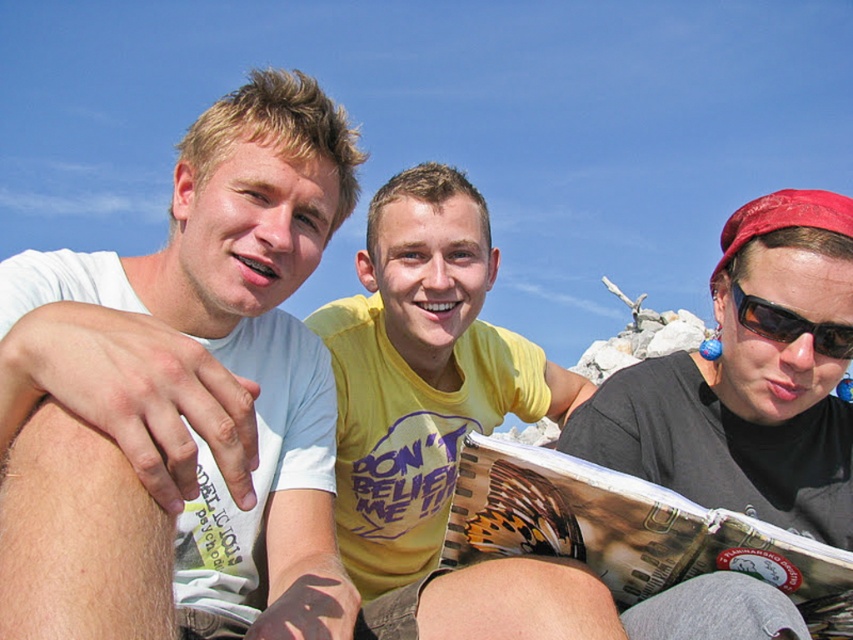
Question: Is white matte t-shirt at left thinner than black plastic sunglasses at right?

Choices:
 (A) no
 (B) yes

Answer: (A)

Question: Which object is farther from the camera taking this photo?

Choices:
 (A) printed paper magazine at center
 (B) yellow t-shirt at center
 (C) matte black sunglasses at upper right
 (D) black plastic sunglasses at right

Answer: (D)

Question: Among these points, which one is nearest to the camera?

Choices:
 (A) (451, 269)
 (B) (47, 292)

Answer: (B)

Question: Is printed paper magazine at center positioned before black plastic sunglasses at right?

Choices:
 (A) no
 (B) yes

Answer: (B)

Question: Which object is farther from the camera taking this photo?

Choices:
 (A) white matte t-shirt at left
 (B) matte black sunglasses at upper right

Answer: (B)

Question: Does matte black sunglasses at upper right have a lesser width compared to printed paper magazine at center?

Choices:
 (A) no
 (B) yes

Answer: (A)